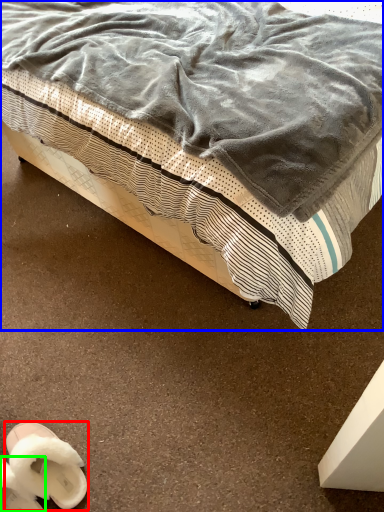
Question: Estimate the real-world distances between objects in this image. Which object is closer to footwear (highlighted by a red box), bed (highlighted by a blue box) or footwear (highlighted by a green box)?

Choices:
 (A) bed
 (B) footwear

Answer: (B)